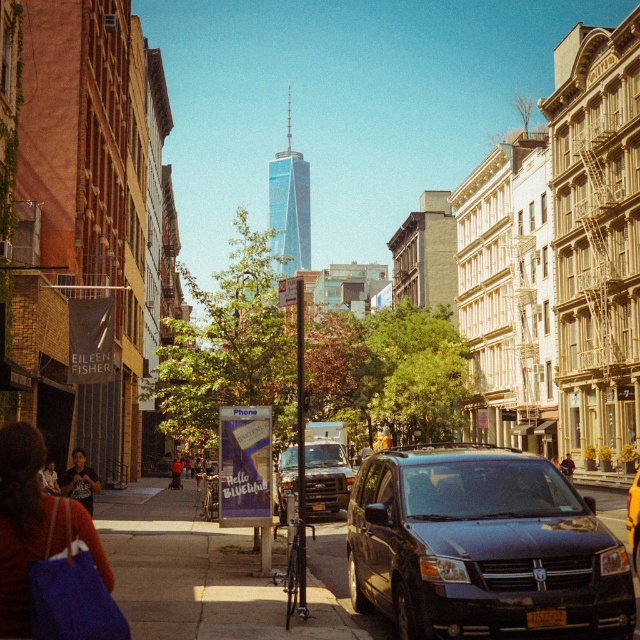
Question: Which point appears closest to the camera in this image?

Choices:
 (A) (90, 502)
 (B) (102, 600)
 (C) (236, 620)

Answer: (B)

Question: Can you confirm if smooth concrete sidewalk at center is thinner than matte black van at center?

Choices:
 (A) yes
 (B) no

Answer: (B)

Question: Which of the following is the farthest from the observer?

Choices:
 (A) (72, 627)
 (B) (333, 444)

Answer: (B)

Question: Is purple fabric bag at lower left wider than matte black van at center?

Choices:
 (A) yes
 (B) no

Answer: (B)

Question: Estimate the real-world distances between objects in this image. Which object is farther from the dark gray t-shirt at lower left?

Choices:
 (A) matte purple bag at lower left
 (B) yellow matte taxi at center
 (C) purple fabric bag at lower left

Answer: (B)

Question: Is smooth concrete sidewalk at center wider than matte purple bag at lower left?

Choices:
 (A) yes
 (B) no

Answer: (A)